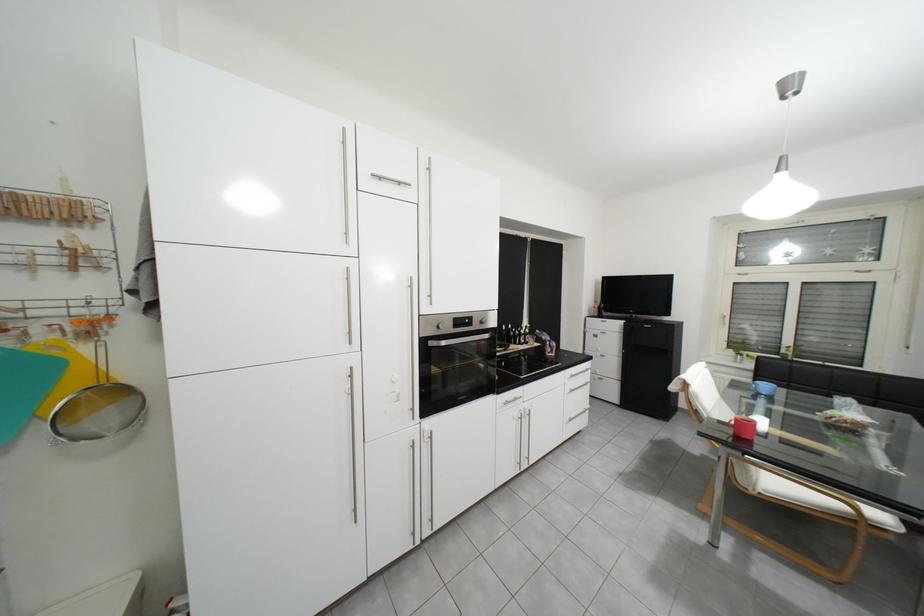
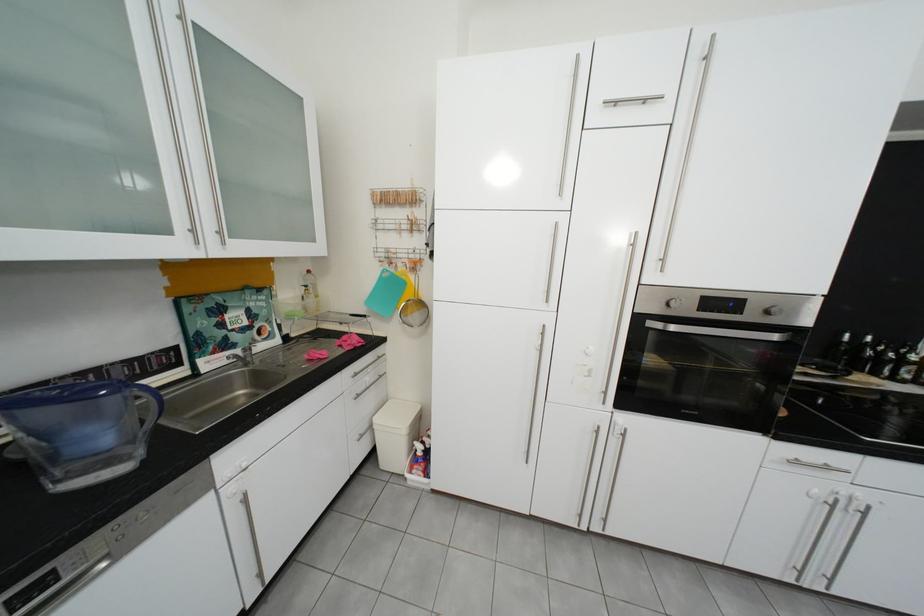
In the second image, find the point that corresponds to point (435, 342) in the first image.

(650, 320)